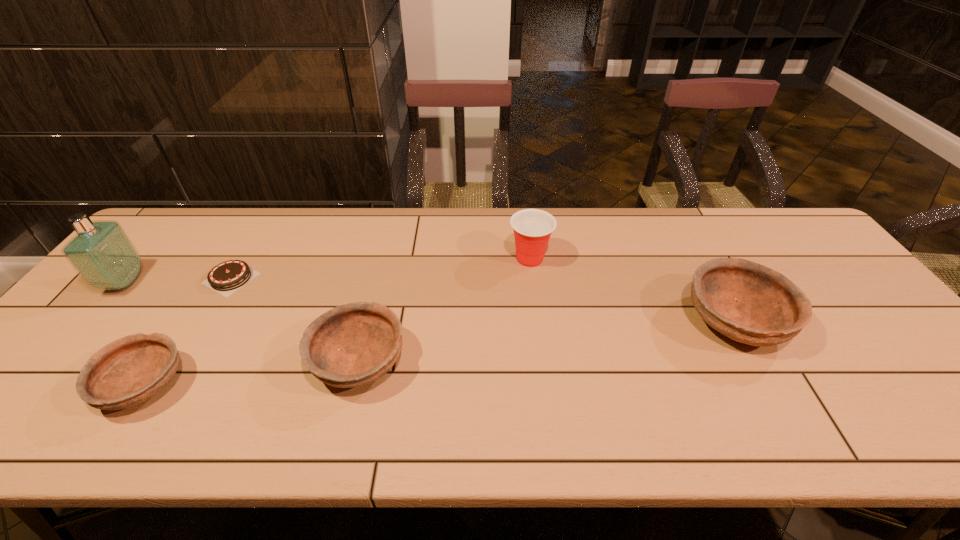
To achieve even spacing by inserting another bowl among them, please point to a vacant spot for this new bowl. Please provide its 2D coordinates. Your answer should be formatted as a tuple, i.e. [(x, y)], where the tuple contains the x and y coordinates of a point satisfying the conditions above.

[(554, 340)]